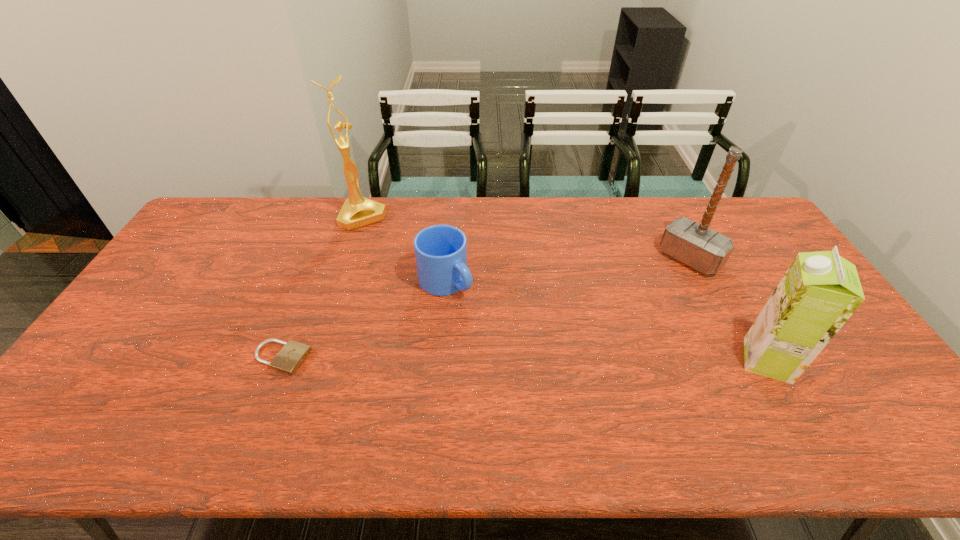
You are a GUI agent. You are given a task and a screenshot of the screen. Output one action in this format:
    pyautogui.click(x=<x>, y=<y>)
    Task: Click on the shortest object
    
    Given the screenshot: What is the action you would take?
    pyautogui.click(x=288, y=360)

The width and height of the screenshot is (960, 540). Identify the location of soya milk. (820, 291).

The width and height of the screenshot is (960, 540). In order to click on award in this screenshot , I will do `click(357, 211)`.

Locate an element on the screen. Image resolution: width=960 pixels, height=540 pixels. the tallest object is located at coordinates (357, 211).

Identify the location of hammer. The height and width of the screenshot is (540, 960). (694, 244).

Where is `the third object from left to right`? This screenshot has height=540, width=960. the third object from left to right is located at coordinates (440, 250).

In order to click on mug in this screenshot , I will do `click(440, 250)`.

The width and height of the screenshot is (960, 540). What are the coordinates of `vacant space located on the right of the shortest object` in the screenshot? It's located at (341, 358).

Locate an element on the screen. vacant point located on the back of the soya milk is located at coordinates (730, 293).

Image resolution: width=960 pixels, height=540 pixels. I want to click on free space located on the front-facing side of the tallest object, so click(x=388, y=251).